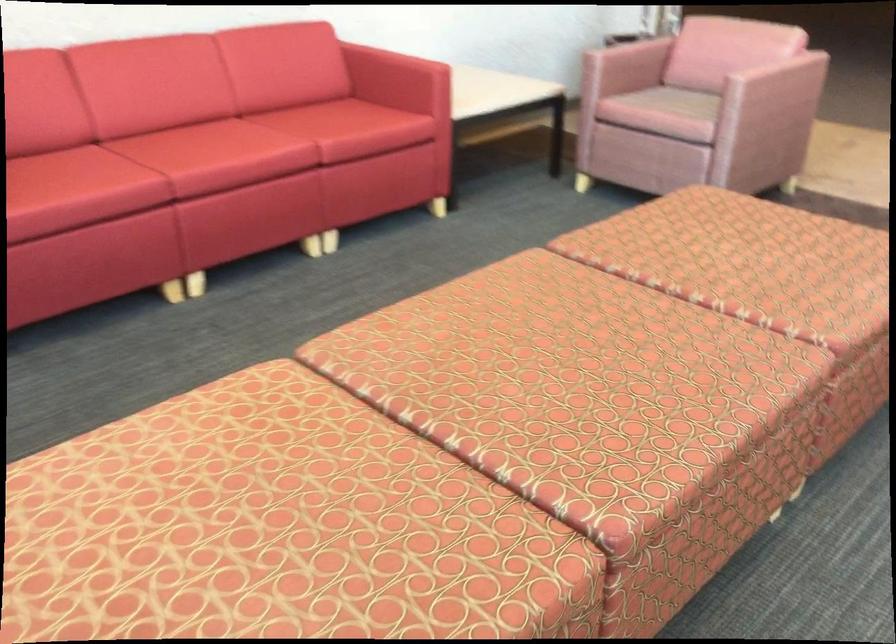
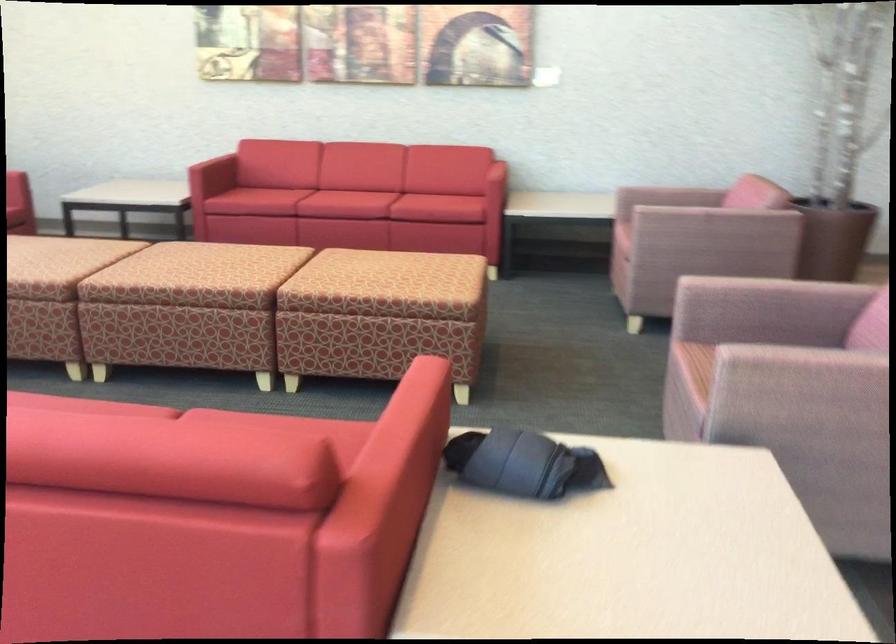
Locate, in the second image, the point that corresponds to the point at 138,225 in the first image.

(265, 200)